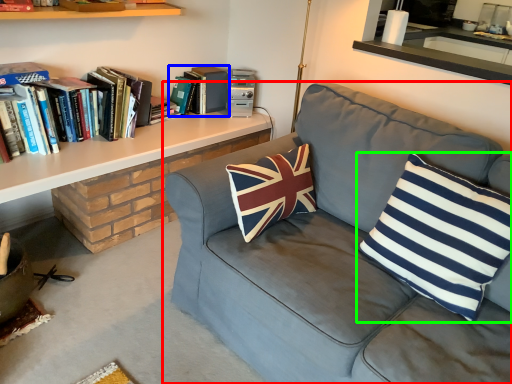
Question: Which is farther away from studio couch (highlighted by a red box)? book (highlighted by a blue box) or pillow (highlighted by a green box)?

Choices:
 (A) book
 (B) pillow

Answer: (A)